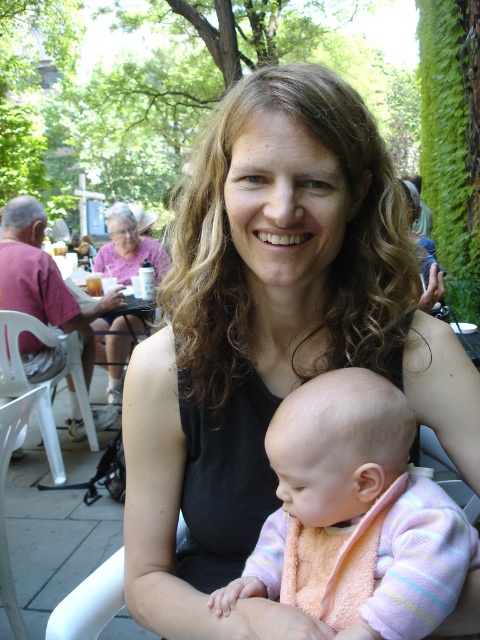
In the scene shown: You are a photographer trying to capture a photo of the black fabric tank top at center and the matte pink shirt at upper left. Which one is located to the right of the other?

The black fabric tank top at center is positioned on the right side of matte pink shirt at upper left.

You are a photographer trying to capture a clear shot of the pastel striped sweater at center without the black fabric tank top at center blocking it. Based on their positions, is this possible?

The pastel striped sweater at center is behind the black fabric tank top at center, so it is currently blocked and not visible. To capture a clear shot of the pastel striped sweater at center, you would need to adjust the angle or position to ensure it is not obscured by the black fabric tank top at center.